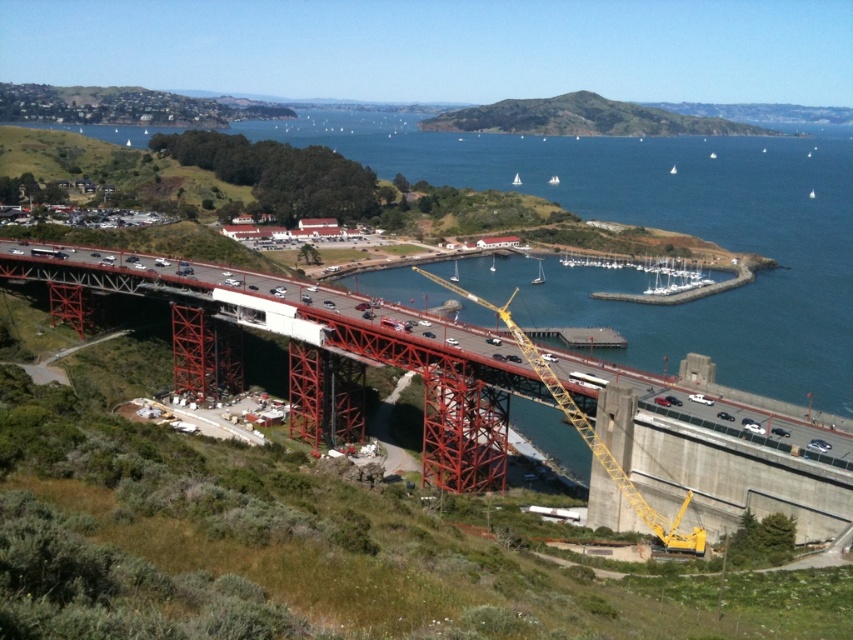
Is green grassy hillside at upper center thinner than yellow metallic crane at center?

No.

Between point (761, 131) and point (524, 349), which one is positioned in front?

Point (524, 349)

Where is `green grassy hillside at upper center`? The height and width of the screenshot is (640, 853). green grassy hillside at upper center is located at coordinates (583, 118).

What do you see at coordinates (583, 118) in the screenshot? I see `green grassy hillside at upper center` at bounding box center [583, 118].

Which is in front, point (662, 120) or point (669, 173)?

Point (669, 173) is more forward.

Where is `green grassy hillside at upper center`? green grassy hillside at upper center is located at coordinates (583, 118).

Is point (650, 198) positioned after point (518, 184)?

No, (650, 198) is in front of (518, 184).

What do you see at coordinates (659, 227) in the screenshot? The image size is (853, 640). I see `blue water at center` at bounding box center [659, 227].

Where is `blue water at center`? The height and width of the screenshot is (640, 853). blue water at center is located at coordinates (659, 227).